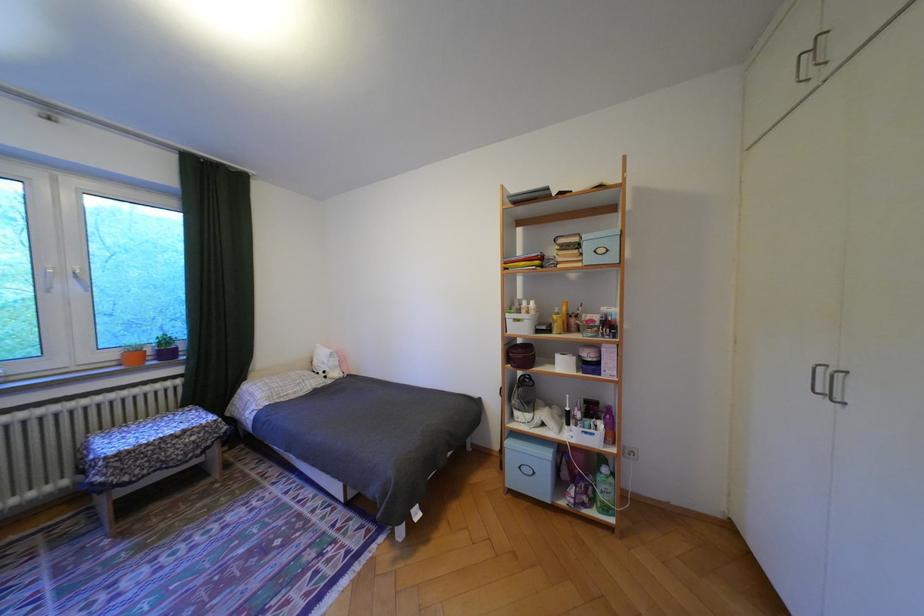
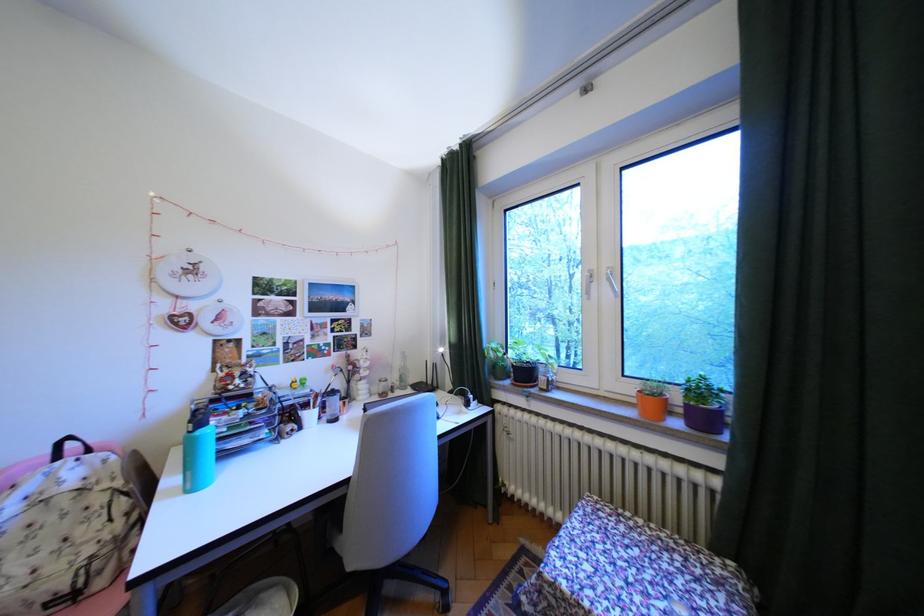
The point at (124, 355) is marked in the first image. Where is the corresponding point in the second image?

(641, 390)